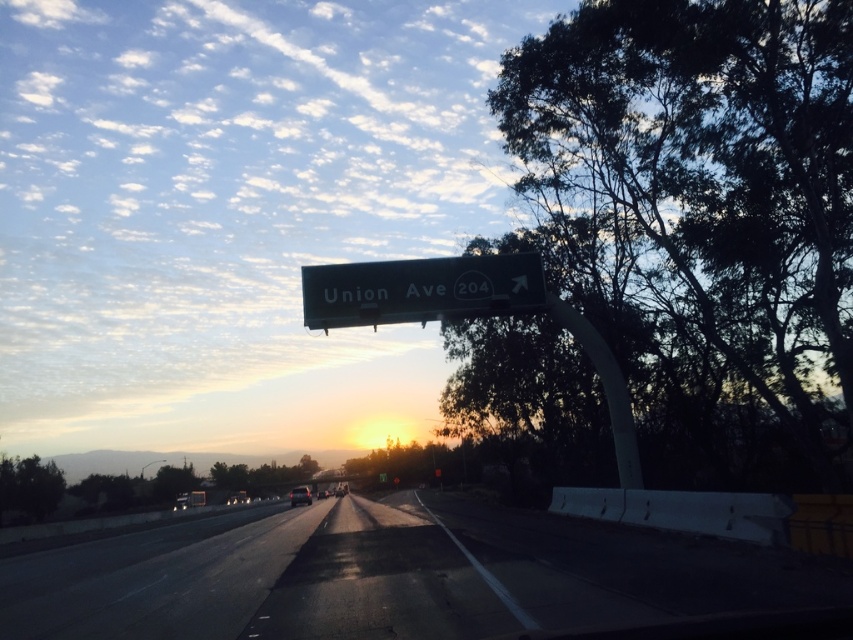
Question: Which point is closer to the camera?

Choices:
 (A) click(x=376, y=260)
 (B) click(x=283, y=561)
 (C) click(x=792, y=81)
 (D) click(x=310, y=497)

Answer: (B)

Question: Is green leafy tree at upper right below green leafy tree at lower left?

Choices:
 (A) no
 (B) yes

Answer: (A)

Question: Estimate the real-world distances between objects in this image. Which object is farther from the shiny silver sedan at center?

Choices:
 (A) green leafy tree at upper right
 (B) green metallic sign at center
 (C) green leafy tree at lower left
 (D) black asphalt highway at center

Answer: (B)

Question: Does green metallic sign at center appear under shiny silver sedan at center?

Choices:
 (A) yes
 (B) no

Answer: (B)

Question: Can you confirm if green leafy tree at upper right is smaller than green metallic sign at center?

Choices:
 (A) no
 (B) yes

Answer: (A)

Question: Which object is closer to the camera taking this photo?

Choices:
 (A) green leafy tree at lower left
 (B) green metallic sign at center

Answer: (B)